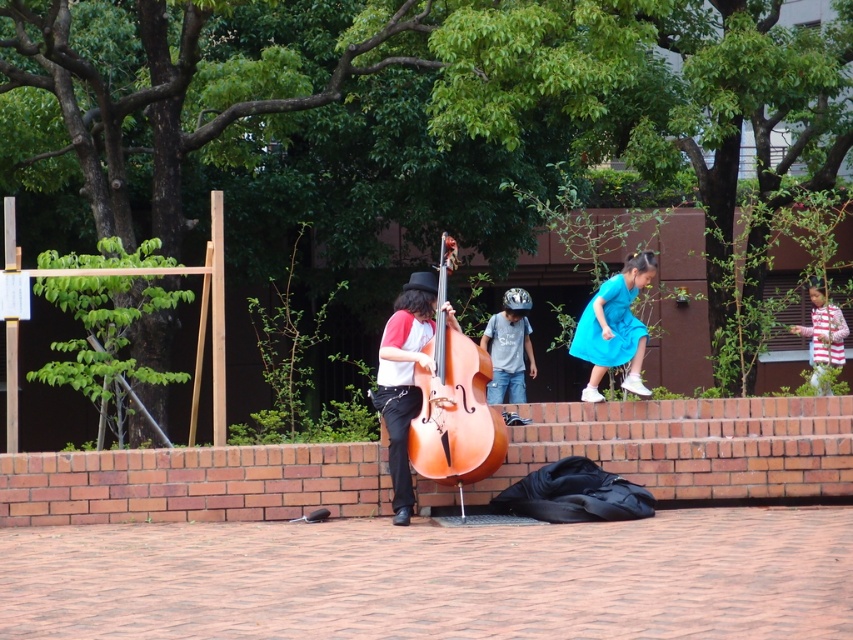
Question: Is matte blue dress at upper right above blue denim jeans at center?

Choices:
 (A) yes
 (B) no

Answer: (A)

Question: Does matte blue dress at upper right appear under striped cotton shirt at right?

Choices:
 (A) yes
 (B) no

Answer: (A)

Question: Estimate the real-world distances between objects in this image. Which object is closer to the wooden polished cello at center?

Choices:
 (A) matte blue dress at upper right
 (B) matte brown cello at center

Answer: (B)

Question: Considering the real-world distances, which object is farthest from the wooden polished cello at center?

Choices:
 (A) matte blue dress at upper right
 (B) blue denim jeans at center

Answer: (B)

Question: Which point is farther to the camera?

Choices:
 (A) click(x=412, y=337)
 (B) click(x=462, y=468)

Answer: (A)

Question: Is wooden polished cello at center to the left of matte brown cello at center from the viewer's perspective?

Choices:
 (A) yes
 (B) no

Answer: (B)